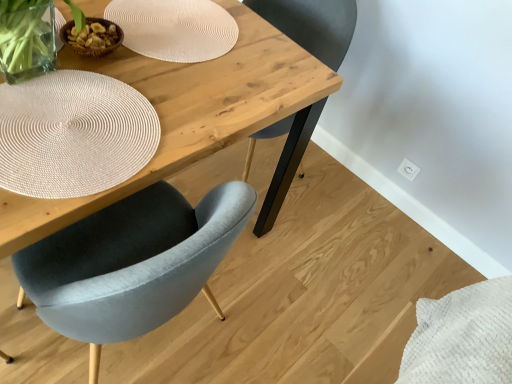
Find the location of a particular element. The image size is (512, 384). free space in front of white textured placemat at upper center, the 2th paper plate viewed from the front is located at coordinates tap(139, 105).